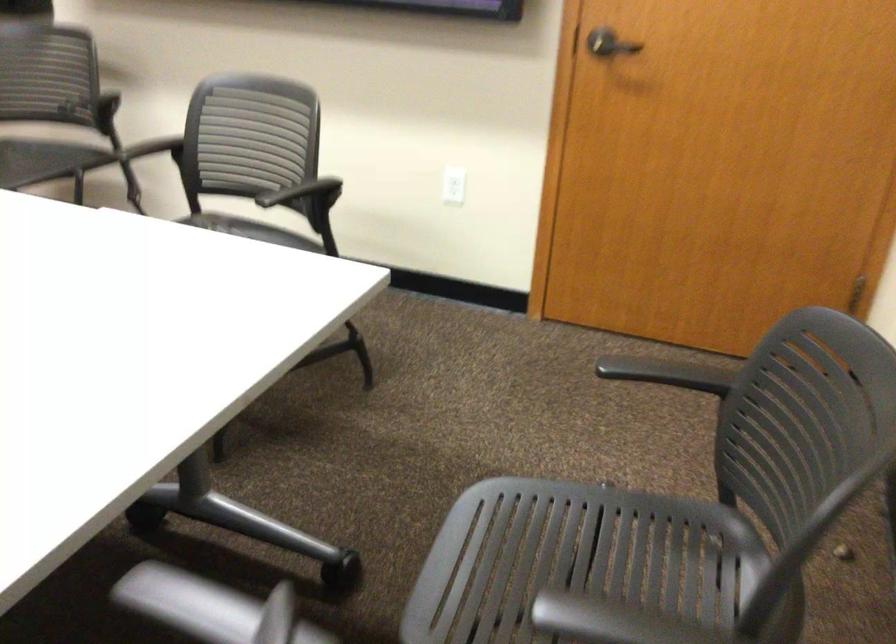
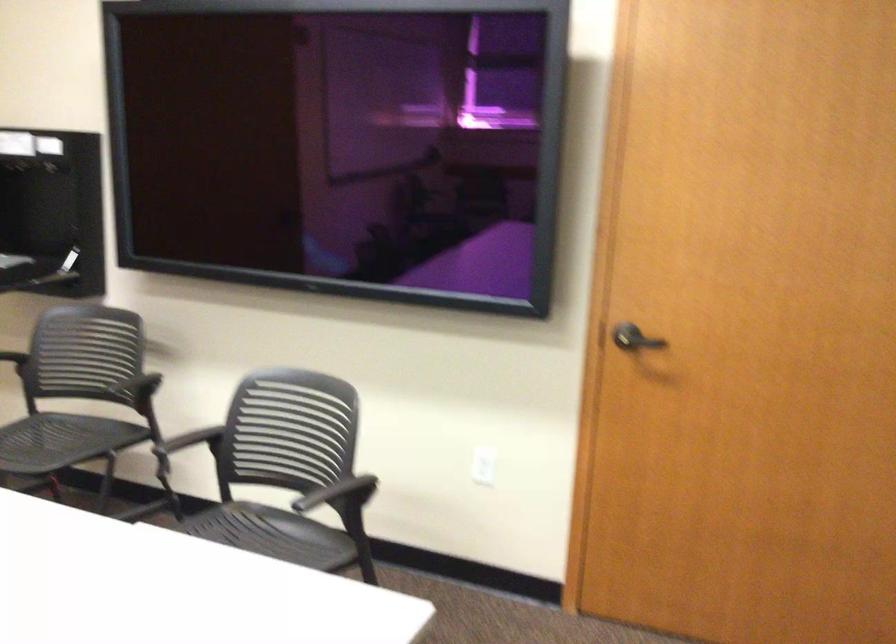
In the second image, find the point that corresponds to point (304, 192) in the first image.

(337, 493)